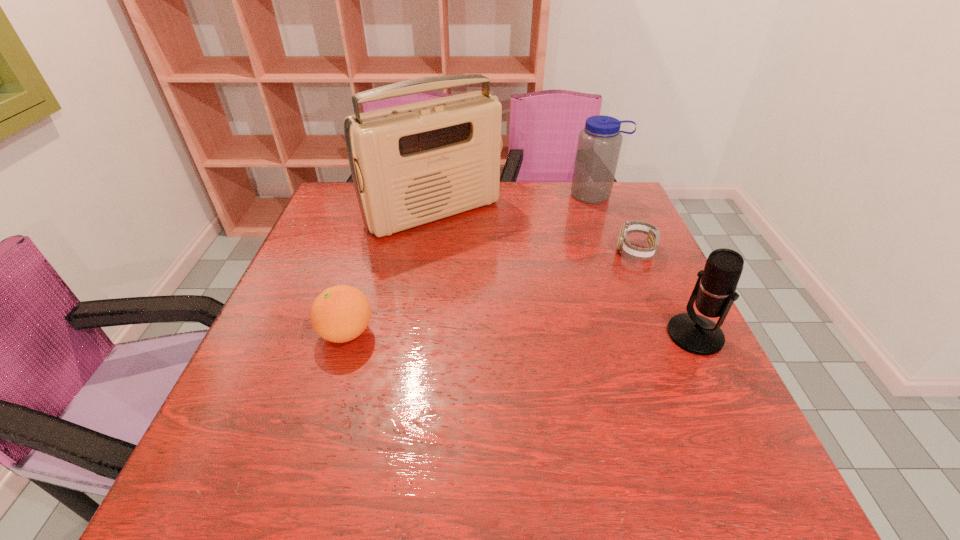
This screenshot has height=540, width=960. I want to click on microphone located in the right edge section of the desktop, so click(714, 293).

Where is `watch that is at the right edge`? The width and height of the screenshot is (960, 540). watch that is at the right edge is located at coordinates (624, 247).

Find the location of `water bottle located in the right edge section of the desktop`. water bottle located in the right edge section of the desktop is located at coordinates (599, 143).

Identify the location of object present at the far left corner. (412, 164).

Locate an element on the screen. The width and height of the screenshot is (960, 540). object present at the far right corner is located at coordinates (599, 143).

Locate an element on the screen. Image resolution: width=960 pixels, height=540 pixels. vacant area at the far edge of the desktop is located at coordinates (549, 223).

The image size is (960, 540). Identify the location of free spot at the near edge of the desktop. (386, 406).

In the image, there is a desktop. Identify the location of vacant space at the left edge. This screenshot has width=960, height=540. (342, 261).

Image resolution: width=960 pixels, height=540 pixels. Identify the location of vacant area at the right edge. (682, 302).

This screenshot has height=540, width=960. In the image, there is a desktop. What are the coordinates of `free region at the near left corner` in the screenshot? It's located at (295, 397).